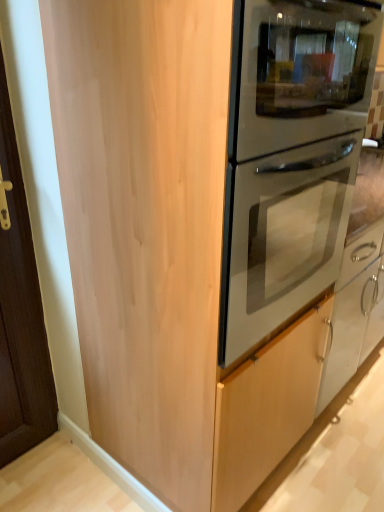
Question: Is silver metallic door handle at lower right facing away from matte silver oven at center?

Choices:
 (A) yes
 (B) no

Answer: (B)

Question: Is silver metallic door handle at lower right outside of matte silver oven at center?

Choices:
 (A) no
 (B) yes

Answer: (B)

Question: From the image's perspective, is silver metallic door handle at lower right on top of matte silver oven at center?

Choices:
 (A) yes
 (B) no

Answer: (B)

Question: Would you say matte silver oven at center is part of silver metallic door handle at lower right's contents?

Choices:
 (A) no
 (B) yes

Answer: (A)

Question: Is the position of silver metallic door handle at lower right more distant than that of matte silver oven at center?

Choices:
 (A) yes
 (B) no

Answer: (A)

Question: Can you see silver metallic door handle at lower right touching matte silver oven at center?

Choices:
 (A) yes
 (B) no

Answer: (B)

Question: Could you tell me if matte silver oven at center is facing silver metallic door handle at lower right?

Choices:
 (A) yes
 (B) no

Answer: (B)

Question: Is matte silver oven at center shorter than silver metallic door handle at lower right?

Choices:
 (A) no
 (B) yes

Answer: (A)

Question: Would you say matte silver oven at center is outside silver metallic door handle at lower right?

Choices:
 (A) yes
 (B) no

Answer: (A)

Question: Is the position of matte silver oven at center less distant than that of silver metallic door handle at lower right?

Choices:
 (A) no
 (B) yes

Answer: (B)

Question: Is silver metallic door handle at lower right completely or partially inside matte silver oven at center?

Choices:
 (A) no
 (B) yes

Answer: (A)

Question: Is matte silver oven at center at the left side of silver metallic door handle at lower right?

Choices:
 (A) no
 (B) yes

Answer: (B)

Question: Is matte silver oven at center wider or thinner than silver metallic door handle at lower right?

Choices:
 (A) wide
 (B) thin

Answer: (A)